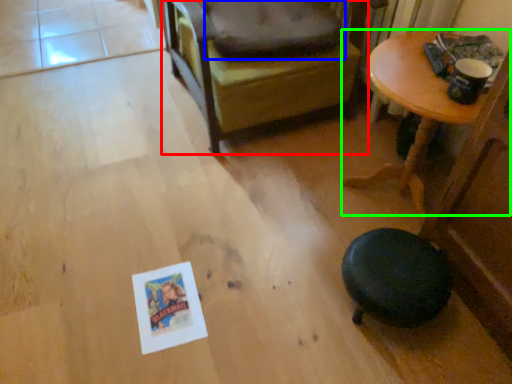
Question: Estimate the real-world distances between objects in this image. Which object is closer to chair (highlighted by a red box), dog bed (highlighted by a blue box) or table (highlighted by a green box)?

Choices:
 (A) dog bed
 (B) table

Answer: (A)